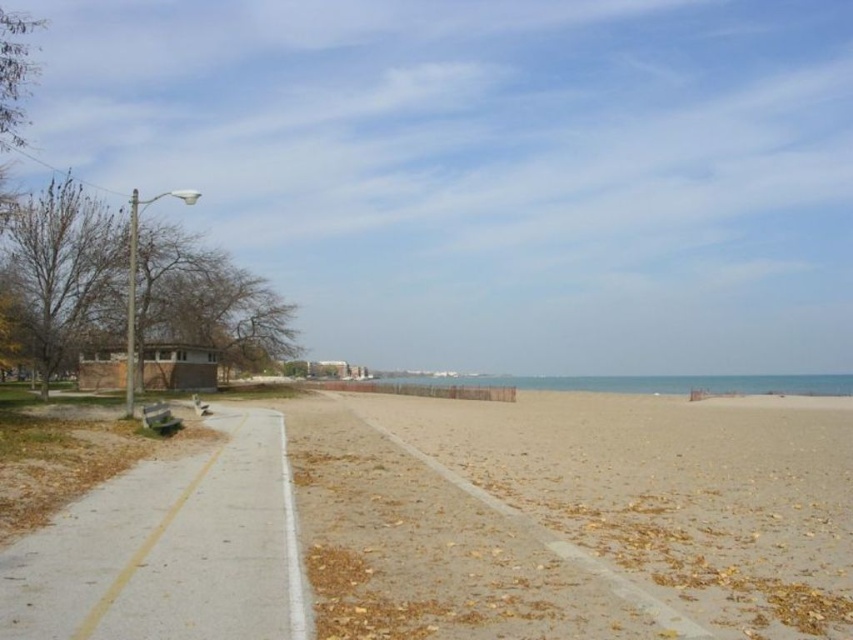
You are standing at the viewpoint and want to reach the point marked as point [787,397]. If you can walk at a speed of 3 feet per second, how long will it take you to reach that point?

The distance between you and point [787,397] is 261.92 feet. At a walking speed of 3 feet per second, it will take approximately 87.3 seconds to reach the point.

You are a painter setting up your easel on the beach. You want to choose a spot where the concrete at left and wooden park bench at lower left are both visible in your painting. Which object should you position closer to ensure both are in frame?

The wooden park bench at lower left is wider than the concrete at left, so positioning closer to the wooden park bench at lower left will allow both objects to be visible in the painting.

In the scene shown: You are standing on the brown sandy beach at center and want to sit on the wooden park bench at lower left. Which direction should you walk to get there?

Since the brown sandy beach at center is closer to the viewer than the wooden park bench at lower left, you should walk towards the lower left direction to reach the wooden park bench at lower left from the brown sandy beach at center.